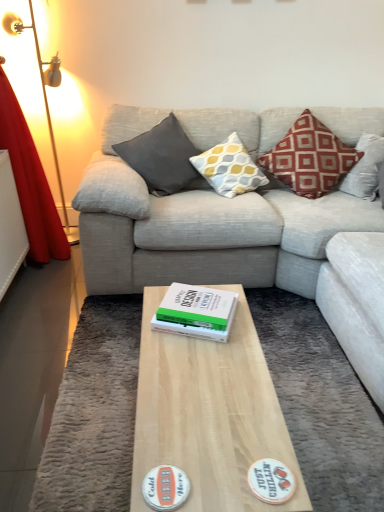
Where is `empty space that is ontop of light wood coffee table at center (from a real-world perspective)`? empty space that is ontop of light wood coffee table at center (from a real-world perspective) is located at coordinates (213, 388).